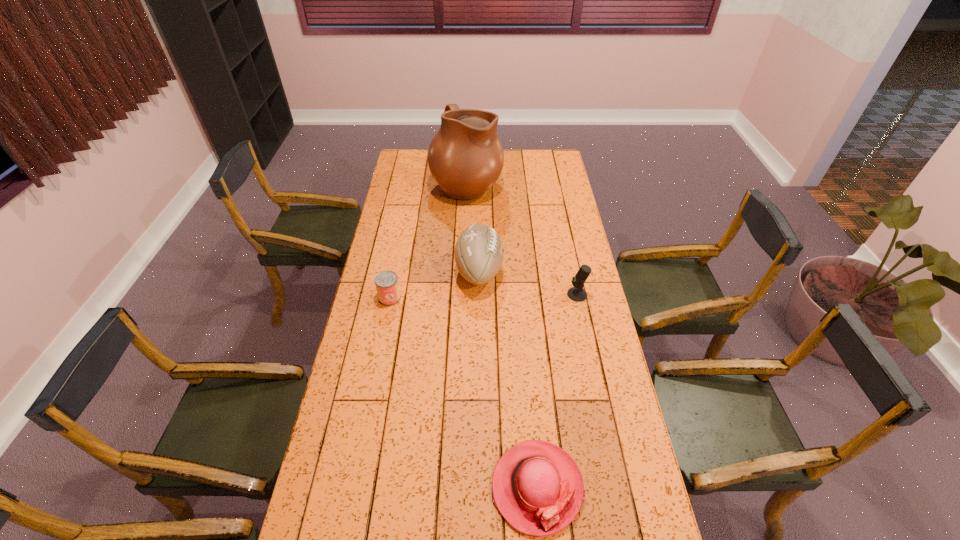
Locate an element on the screen. the farthest object is located at coordinates tap(465, 157).

The width and height of the screenshot is (960, 540). I want to click on cream pitcher, so pos(465,157).

Where is `football (American)`? This screenshot has width=960, height=540. football (American) is located at coordinates (478, 253).

Locate an element on the screen. The image size is (960, 540). the rightmost object is located at coordinates (577, 293).

Locate an element on the screen. The width and height of the screenshot is (960, 540). the third shortest object is located at coordinates (577, 293).

You are a GUI agent. You are given a task and a screenshot of the screen. Output one action in this format:
    pyautogui.click(x=<x>, y=<y>)
    Task: Click on the can
    The width and height of the screenshot is (960, 540).
    Given the screenshot: What is the action you would take?
    pyautogui.click(x=386, y=282)

I want to click on hat, so click(537, 487).

You are a GUI agent. You are given a task and a screenshot of the screen. Output one action in this format:
    pyautogui.click(x=<x>, y=<y>)
    Task: Click on the vacant space located 0.090m at the spout of the farthest object
    This screenshot has height=540, width=960.
    Given the screenshot: What is the action you would take?
    pyautogui.click(x=520, y=183)

Where is `free spot located 0.170m on the laces of the football (American)`? This screenshot has width=960, height=540. free spot located 0.170m on the laces of the football (American) is located at coordinates (545, 271).

Find the location of a particular element. The width and height of the screenshot is (960, 540). vacant space situated 0.210m on the back of the third tallest object is located at coordinates click(x=568, y=252).